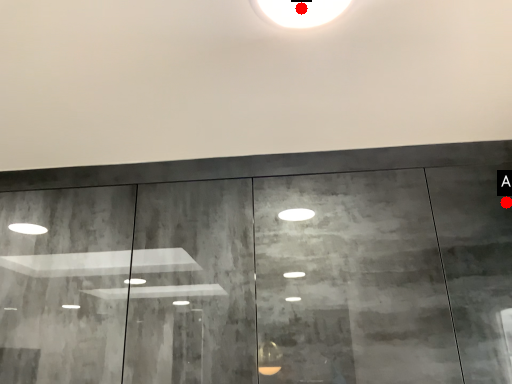
Question: Two points are circled on the image, labeled by A and B beside each circle. Among these points, which one is farthest from the camera?

Choices:
 (A) A is further
 (B) B is further

Answer: (A)